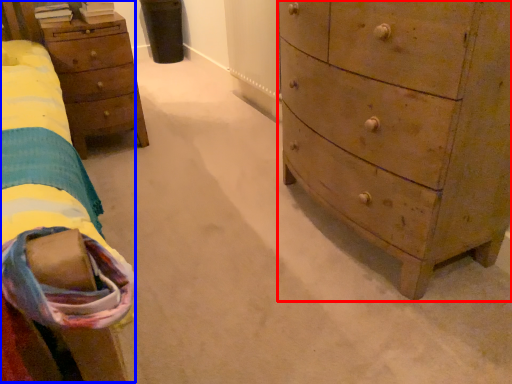
Question: Which object is closer to the camera taking this photo, chest of drawers (highlighted by a red box) or bed (highlighted by a blue box)?

Choices:
 (A) chest of drawers
 (B) bed

Answer: (B)